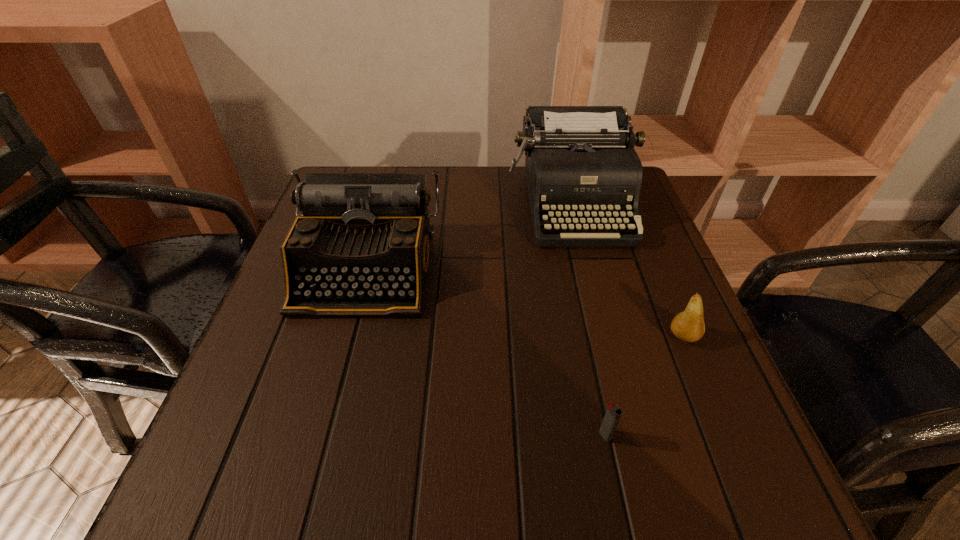
This screenshot has height=540, width=960. Find the location of `object that stands as the closest to the left typewriter`. object that stands as the closest to the left typewriter is located at coordinates (581, 167).

Locate an element on the screen. This screenshot has height=540, width=960. free location that satisfies the following two spatial constraints: 1. on the back side of the pear; 2. on the right side of the igniter is located at coordinates 584,336.

You are a GUI agent. You are given a task and a screenshot of the screen. Output one action in this format:
    pyautogui.click(x=<x>, y=<y>)
    Task: Click on the free space that satisfies the following two spatial constraints: 1. on the front-facing side of the right typewriter; 2. on the right side of the second shortest object
    
    Given the screenshot: What is the action you would take?
    pyautogui.click(x=606, y=336)

Where is `vacant region that satisfies the following two spatial constraints: 1. on the keyboard of the shortest object; 2. on the left side of the left typewriter`? vacant region that satisfies the following two spatial constraints: 1. on the keyboard of the shortest object; 2. on the left side of the left typewriter is located at coordinates (320, 435).

Image resolution: width=960 pixels, height=540 pixels. Identify the location of vacant space that satisfies the following two spatial constraints: 1. on the front-facing side of the second shortest object; 2. on the left side of the right typewriter. (606, 336).

The height and width of the screenshot is (540, 960). What are the coordinates of `vacant space that satisfies the following two spatial constraints: 1. on the keyboard of the left typewriter; 2. on the left side of the shortest object` in the screenshot? It's located at (320, 435).

Locate an element on the screen. This screenshot has height=540, width=960. free space that satisfies the following two spatial constraints: 1. on the front-facing side of the pear; 2. on the left side of the right typewriter is located at coordinates (606, 336).